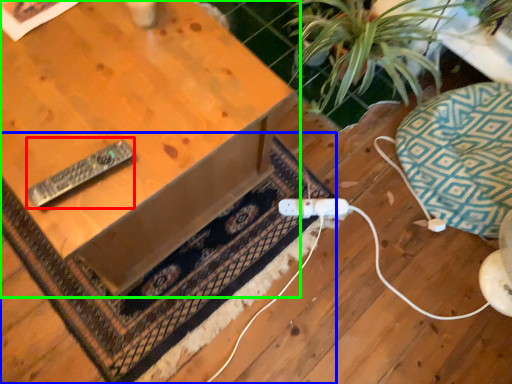
Question: Considering the real-world distances, which object is farthest from remote (highlighted by a red box)? doormat (highlighted by a blue box) or table (highlighted by a green box)?

Choices:
 (A) doormat
 (B) table

Answer: (A)